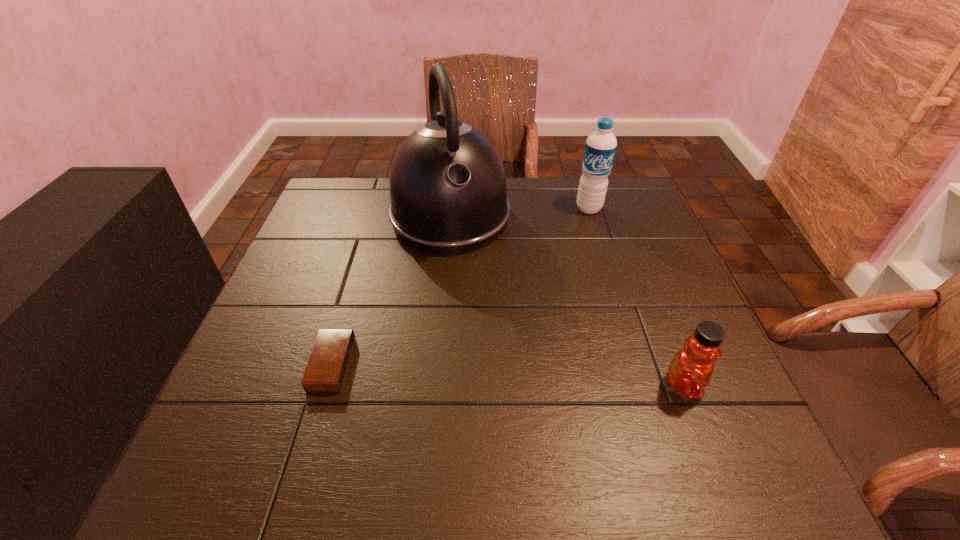
Where is `free space on the desktop that is between the shortest object and the honey and is positioned on the spout of the kettle`? The width and height of the screenshot is (960, 540). free space on the desktop that is between the shortest object and the honey and is positioned on the spout of the kettle is located at coordinates (502, 374).

Find the location of a particular element. free spot on the desktop that is between the shortest object and the third tallest object and is positioned on the label of the water bottle is located at coordinates (525, 376).